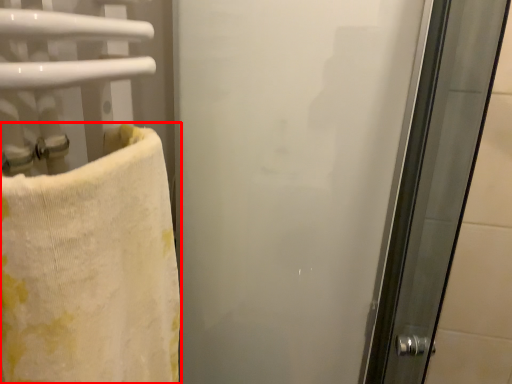
Question: From the image's perspective, where is towel (annotated by the red box) located in relation to screen door in the image?

Choices:
 (A) below
 (B) above

Answer: (A)